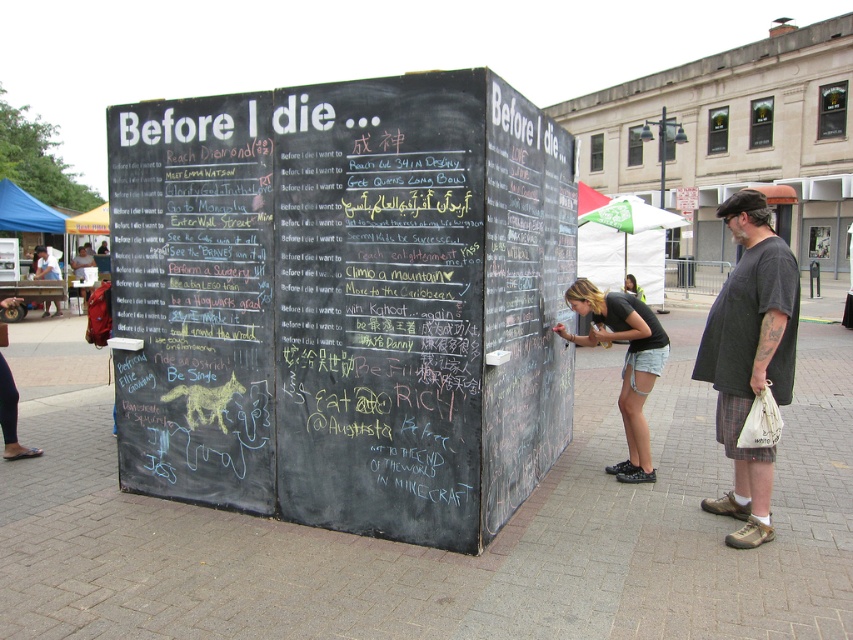
Does black chalkboard at left appear on the left side of green fabric umbrella at upper center?

Indeed, black chalkboard at left is positioned on the left side of green fabric umbrella at upper center.

Can you confirm if black chalkboard at left is wider than green fabric umbrella at upper center?

No.

Where is `black chalkboard at left`? This screenshot has height=640, width=853. black chalkboard at left is located at coordinates (193, 298).

Is point (178, 442) less distant than point (677, 220)?

That is True.

Can you confirm if black chalkboard at center is smaller than green fabric umbrella at upper center?

Correct, black chalkboard at center occupies less space than green fabric umbrella at upper center.

Is point (445, 81) closer to viewer compared to point (633, 214)?

Yes, it is.

The height and width of the screenshot is (640, 853). Identify the location of black chalkboard at center. (344, 301).

Measure the distance between dark gray t-shirt at right and camera.

dark gray t-shirt at right and camera are 13.57 feet apart from each other.

Is point (718, 346) positioned in front of point (616, 234)?

Yes.

Is point (776, 387) positioned before point (618, 234)?

Yes.

The image size is (853, 640). What are the coordinates of `dark gray t-shirt at right` in the screenshot? It's located at (749, 356).